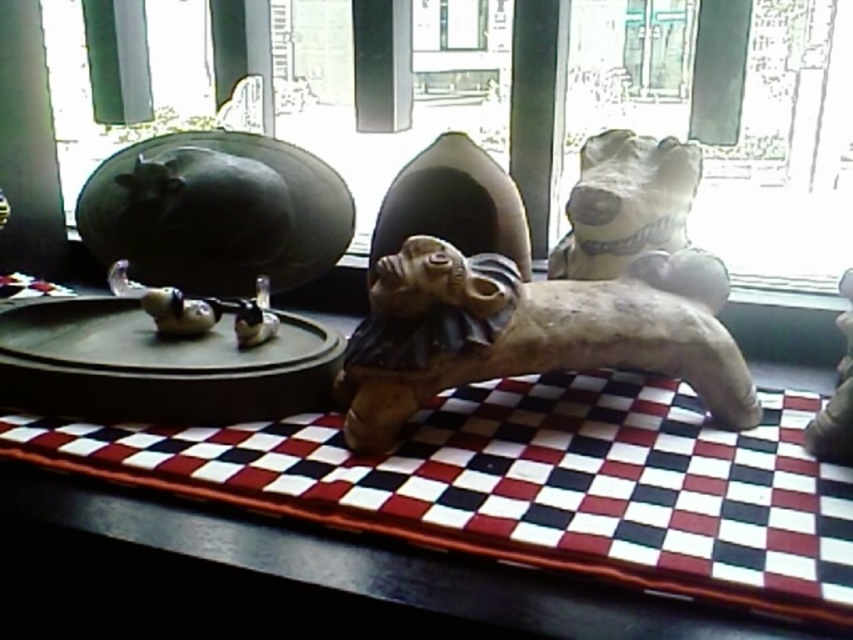
Is matte black statue at center further to camera compared to checkerboard-patterned table at center?

Yes, it is.

Which is behind, point (416, 136) or point (131, 493)?

The point (416, 136) is behind.

What do you see at coordinates (786, 160) in the screenshot? I see `matte black statue at center` at bounding box center [786, 160].

Identify the location of matte black statue at center. (786, 160).

Is the position of matte black statue at center more distant than that of brown clay dog at center?

Yes, matte black statue at center is behind brown clay dog at center.

Between matte black statue at center and brown clay dog at center, which one has more height?

matte black statue at center

The width and height of the screenshot is (853, 640). Describe the element at coordinates (786, 160) in the screenshot. I see `matte black statue at center` at that location.

Where is `matte black statue at center`? The image size is (853, 640). matte black statue at center is located at coordinates (786, 160).

Between checkerboard-patterned table at center and brown clay dog at center, which one has more height?

brown clay dog at center

What do you see at coordinates (302, 577) in the screenshot?
I see `checkerboard-patterned table at center` at bounding box center [302, 577].

Where is `checkerboard-patterned table at center`? The width and height of the screenshot is (853, 640). checkerboard-patterned table at center is located at coordinates (302, 577).